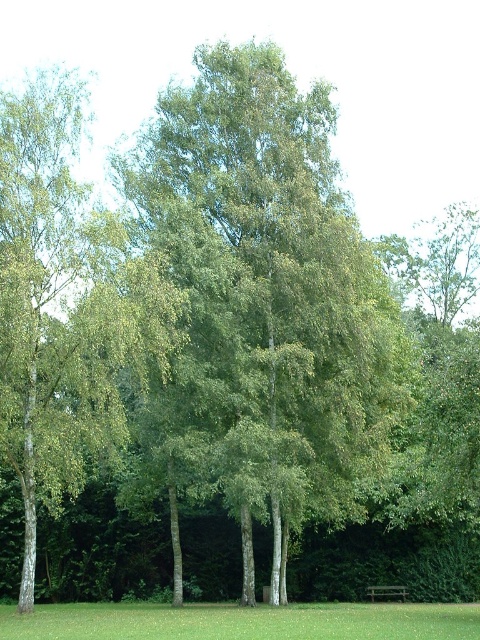
You are planning to have a picnic in the park. You see the green grass at lower center and the wooden park bench at lower center. Which area would provide more space for spreading out a picnic blanket?

The green grass at lower center is bigger than the wooden park bench at lower center, so it would provide more space for spreading out a picnic blanket.

You are standing at the point with coordinates point (386, 634) and want to walk towards the point with coordinates point (162, 184). Will the birch trees block your path?

Point (162, 184) is behind point (386, 634), so the birch trees will block your path to the point (162, 184).